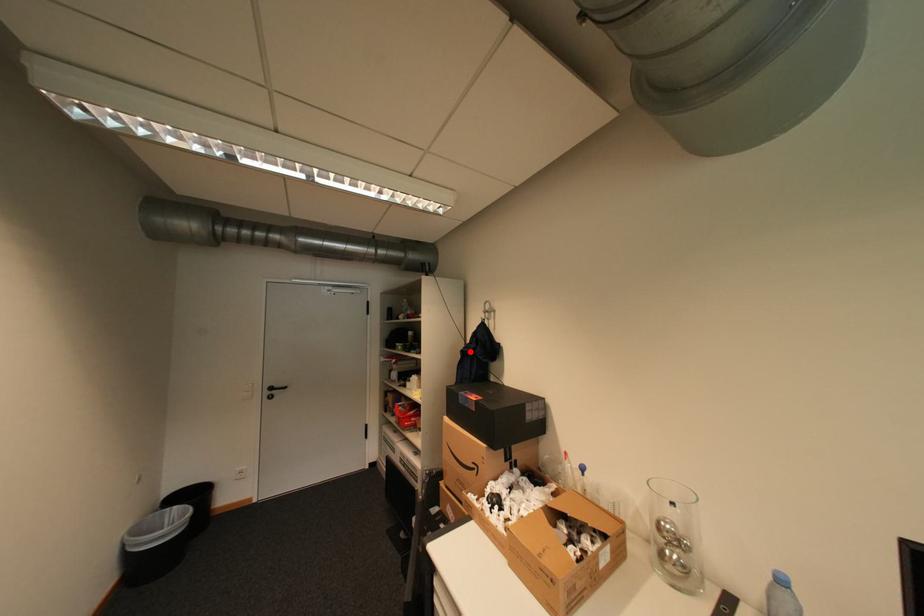
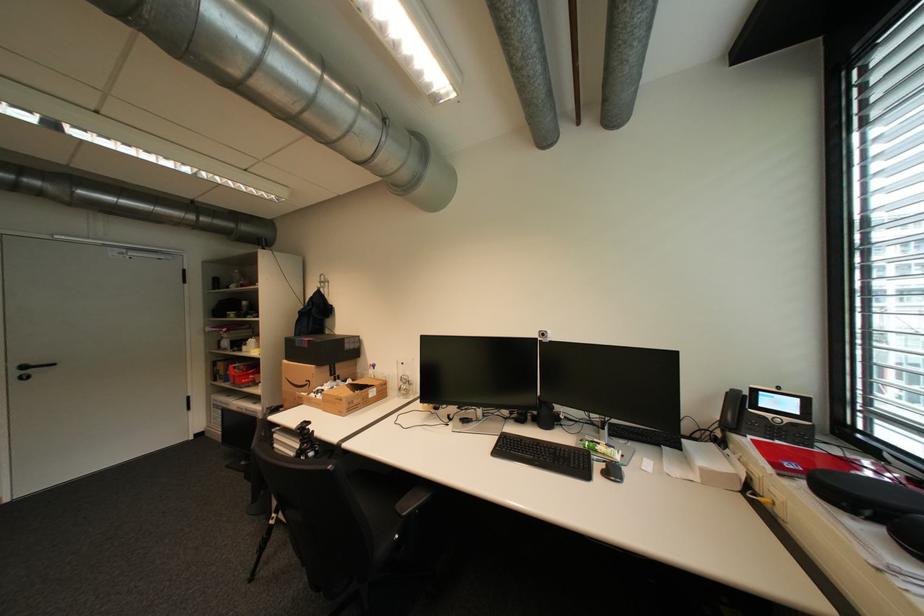
The point at the highlighted location is marked in the first image. Where is the corresponding point in the second image?

(308, 312)